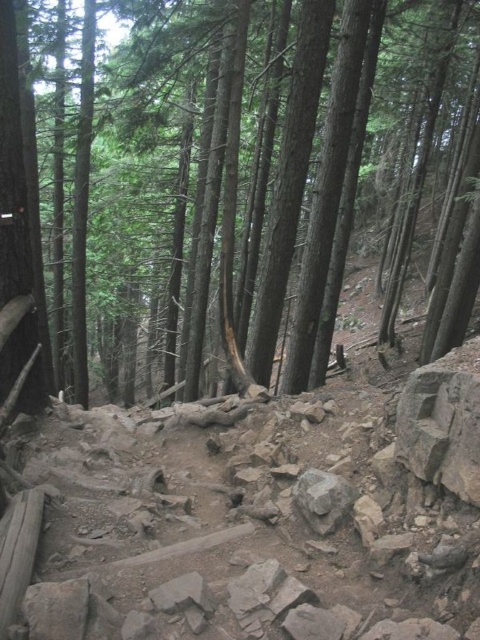
You are a hiker carrying a backpack and need to reach a cabin located 5 meters ahead on this forest trail. There is a brown rough tree at center in your path. Can you walk around it without deviating from your route?

The brown rough tree at center is 4.80 meters away from you. Since the cabin is 5 meters ahead, you can walk around the tree and still reach the cabin within the 5 meters distance.

You are a hiker carrying a backpack and want to cross the forest trail. You notice a brown rough tree at center and a gray rough rock at center. If your backpack has a 10 meter rope, can you tie the rope between them to cross?

The brown rough tree at center is 9.61 meters away from the gray rough rock at center. Since the rope is 10 meters long, it is long enough to tie between them for crossing.